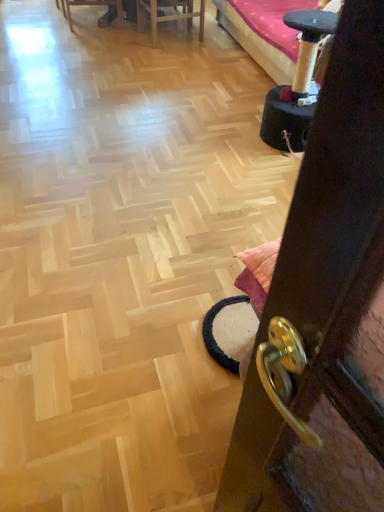
Locate an element on the screen. The height and width of the screenshot is (512, 384). free space in front of wooden chair at upper center is located at coordinates (175, 55).